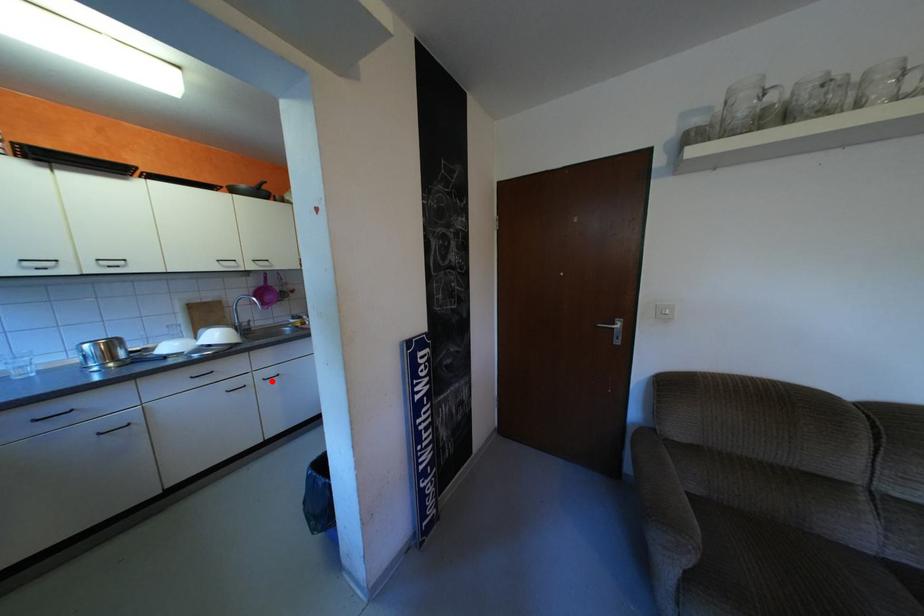
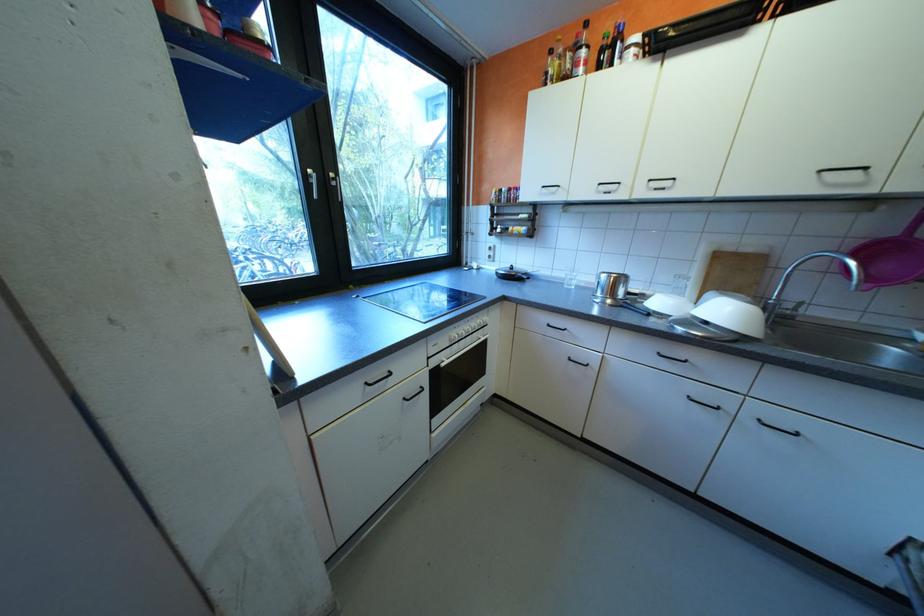
Locate, in the second image, the point that corresponds to the highlighted location in the first image.

(760, 419)